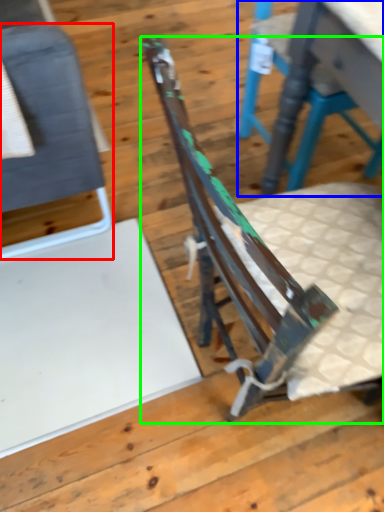
Question: Which object is the farthest from chair (highlighted by a red box)? Choose among these: chair (highlighted by a blue box) or chair (highlighted by a green box).

Choices:
 (A) chair
 (B) chair

Answer: (A)